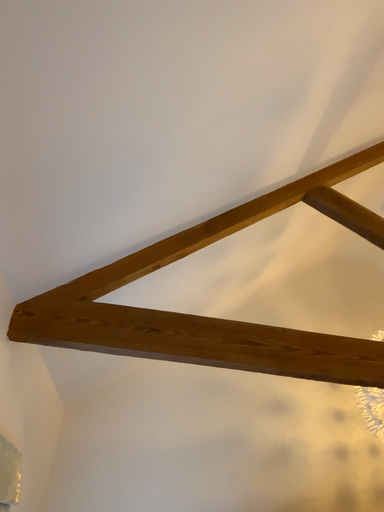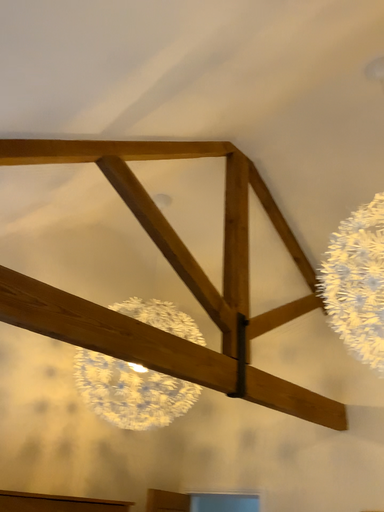
Question: Which way did the camera rotate in the video?

Choices:
 (A) rotated left
 (B) rotated right

Answer: (B)